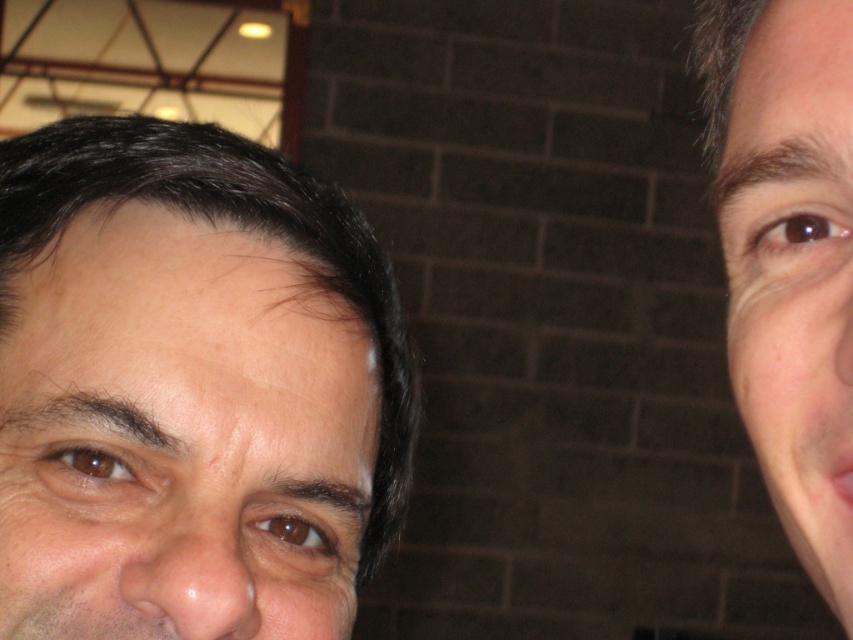
This screenshot has height=640, width=853. Describe the element at coordinates (190, 388) in the screenshot. I see `smooth skin face at left` at that location.

Who is positioned more to the right, smooth skin face at left or smooth skin face at right?

Positioned to the right is smooth skin face at right.

Who is more forward, (335, 461) or (759, 269)?

Point (759, 269) is in front.

At what (x,y) coordinates should I click in order to perform the action: click on smooth skin face at left. Please return your answer as a coordinate pair (x, y). Looking at the image, I should click on (190, 388).